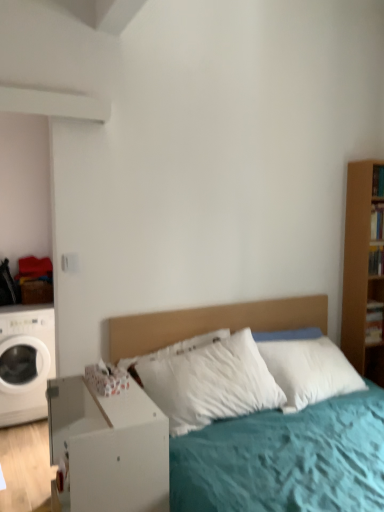
Question: Is white soft bed at center taller than white matte washing machine at left?

Choices:
 (A) no
 (B) yes

Answer: (A)

Question: Does white soft bed at center turn towards white matte washing machine at left?

Choices:
 (A) yes
 (B) no

Answer: (B)

Question: Does white soft bed at center have a smaller size compared to white matte washing machine at left?

Choices:
 (A) yes
 (B) no

Answer: (B)

Question: Is white soft bed at center not inside white matte washing machine at left?

Choices:
 (A) no
 (B) yes

Answer: (B)

Question: Is white soft bed at center to the left of white matte washing machine at left from the viewer's perspective?

Choices:
 (A) no
 (B) yes

Answer: (A)

Question: Does white soft bed at center have a greater width compared to white matte washing machine at left?

Choices:
 (A) yes
 (B) no

Answer: (B)

Question: Considering the relative sizes of white soft bed at center and white matte nightstand at lower left in the image provided, is white soft bed at center wider than white matte nightstand at lower left?

Choices:
 (A) no
 (B) yes

Answer: (B)

Question: From the image's perspective, is white soft bed at center above white matte nightstand at lower left?

Choices:
 (A) no
 (B) yes

Answer: (B)

Question: Is white soft bed at center shorter than white matte nightstand at lower left?

Choices:
 (A) yes
 (B) no

Answer: (B)

Question: Is white soft bed at center taller than white matte nightstand at lower left?

Choices:
 (A) yes
 (B) no

Answer: (A)

Question: Is white soft bed at center looking in the opposite direction of white matte nightstand at lower left?

Choices:
 (A) no
 (B) yes

Answer: (A)

Question: Does white soft bed at center lie behind white matte nightstand at lower left?

Choices:
 (A) yes
 (B) no

Answer: (A)

Question: From the image's perspective, does white matte washing machine at left appear lower than white soft bed at center?

Choices:
 (A) no
 (B) yes

Answer: (B)